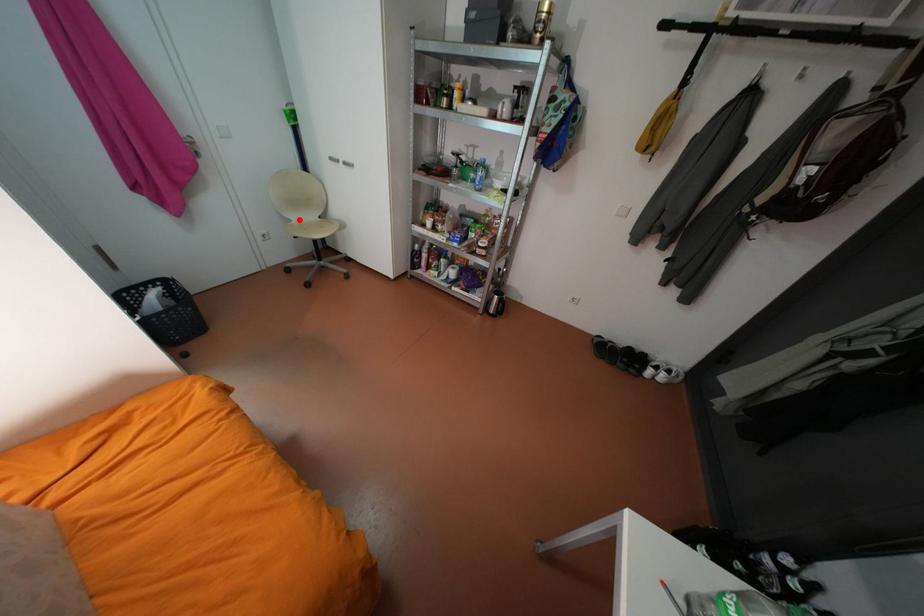
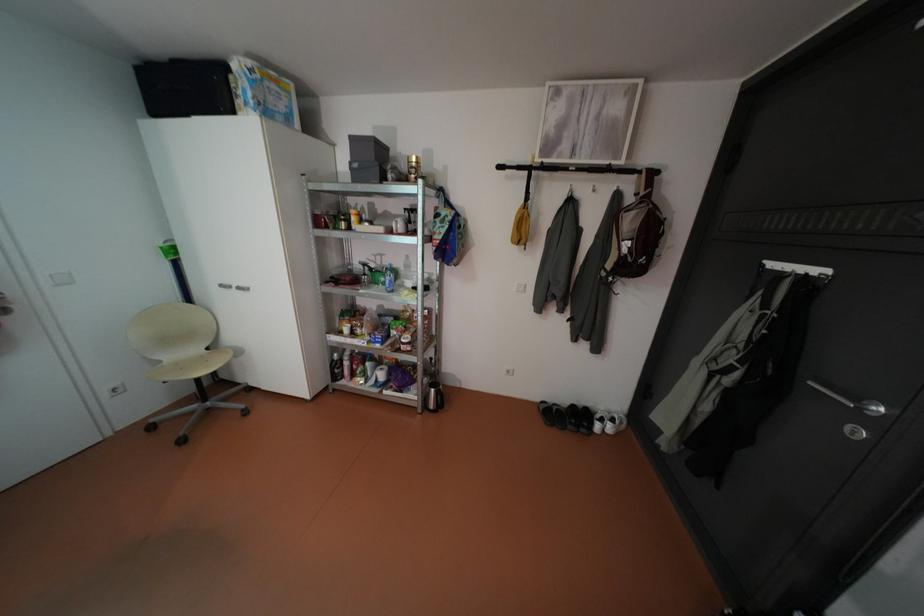
Question: I am providing you with two images of the same scene from different viewpoints. A red point is marked on the first image. Can you still see the location of the red point in image 2?

Choices:
 (A) Yes
 (B) No

Answer: (A)